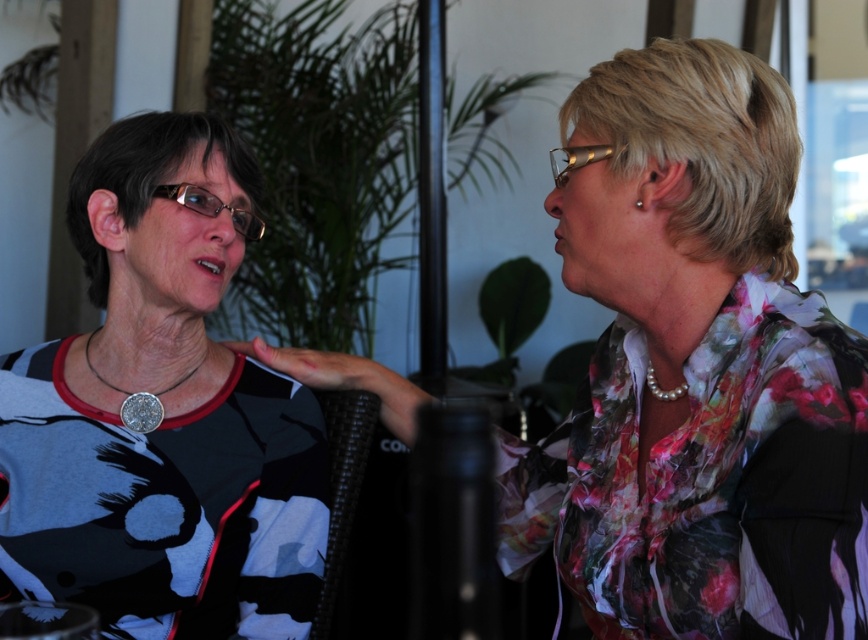
You are an interior designer analyzing the placement of the floral print blouse at center in the image. Based on the coordinates provided in the Objects Description, can you determine if the blouse is positioned closer to the top or bottom of the image?

The floral print blouse at center is located at point (695, 371). Since the y coordinate is 0.802, which is closer to 1.0, it is positioned closer to the bottom of the image.

You are an interior designer assessing the layout of this room. You notice the floral print blouse at center and the matte black shirt at left. Which clothing item appears shorter in the image?

The floral print blouse at center is not as tall as the matte black shirt at left, so the floral print blouse at center appears shorter.

You are a photographer setting up for a portrait shoot in this scene. You want to ensure both the floral print blouse at center and the matte black shirt at left are clearly visible in the photo. Based on their positions, which clothing item might naturally be more in focus if you focus on the person in front?

The floral print blouse at center is in front of the matte black shirt at left, so focusing on the person in front would naturally put the floral print blouse at center in focus while the matte black shirt at left may appear slightly out of focus.